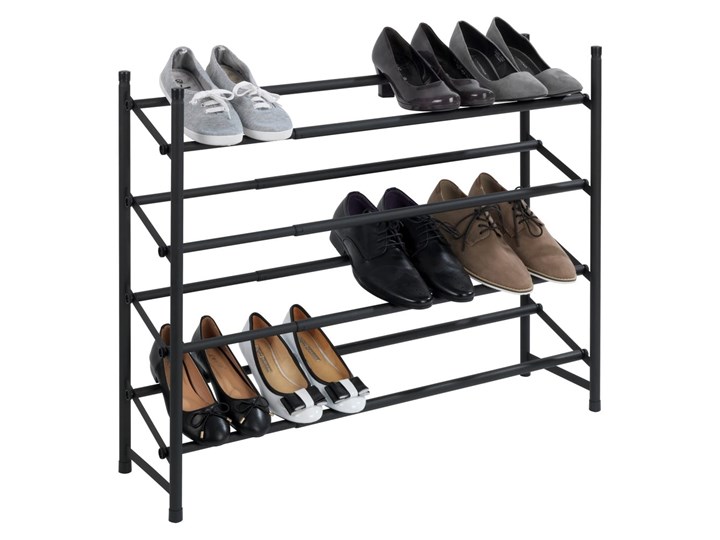
The height and width of the screenshot is (540, 720). I want to click on number of rack levels, so click(x=341, y=124), click(x=364, y=209), click(x=348, y=321), click(x=358, y=386).